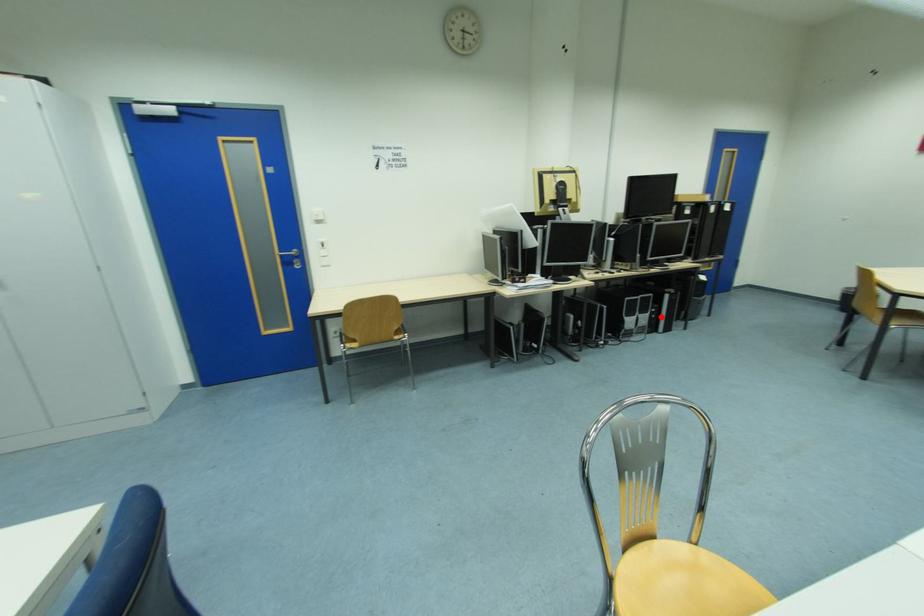
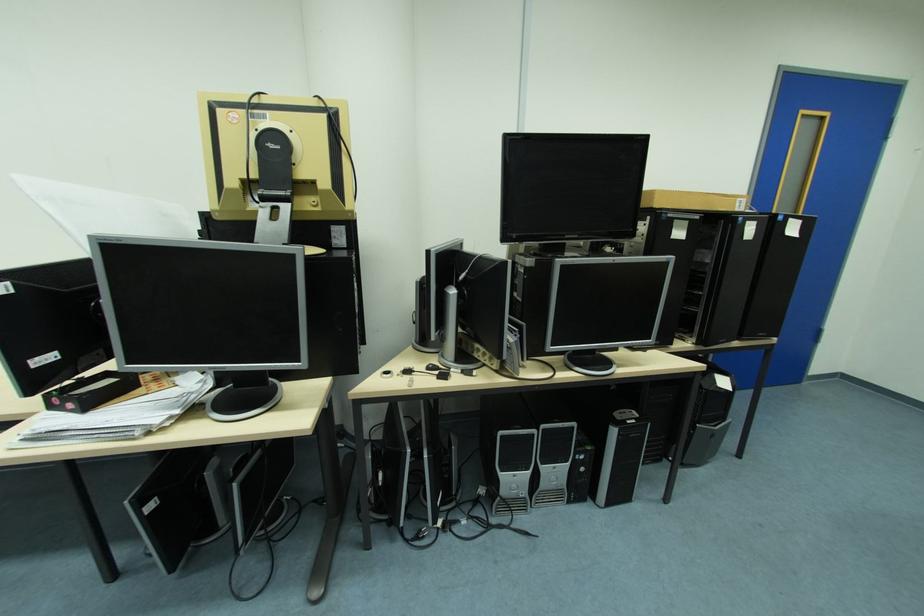
Question: I am providing you with two images of the same scene from different viewpoints. Given a red point in image1, look at the same physical point in image2. Is it:

Choices:
 (A) Closer to the viewpoint
 (B) Farther from the viewpoint

Answer: (B)